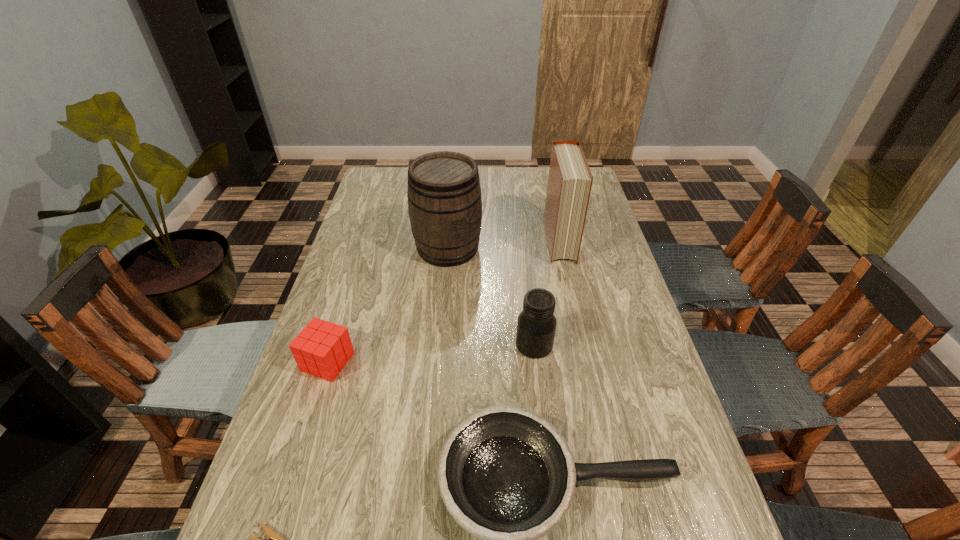
Where is `hardback book`? hardback book is located at coordinates (570, 180).

This screenshot has width=960, height=540. I want to click on wine bucket, so click(x=444, y=195).

This screenshot has width=960, height=540. Find the location of `jar`. jar is located at coordinates (536, 325).

Locate an element on the screen. This screenshot has width=960, height=540. the third shortest object is located at coordinates (322, 349).

Where is `free location located on the open cover of the hardback book`? free location located on the open cover of the hardback book is located at coordinates (570, 295).

At what (x,y) coordinates should I click in order to perform the action: click on vacant position located 0.060m on the front of the wine bucket. Please return your answer as a coordinate pair (x, y). This screenshot has width=960, height=540. Looking at the image, I should click on (444, 283).

I want to click on free location located on the back of the fourth shortest object, so click(523, 253).

Where is `free space located on the back of the fourth tallest object`? The height and width of the screenshot is (540, 960). free space located on the back of the fourth tallest object is located at coordinates (343, 313).

Where is `object situated at the left edge`? object situated at the left edge is located at coordinates (322, 349).

Locate an element on the screen. This screenshot has height=540, width=960. object that is at the right edge is located at coordinates (570, 180).